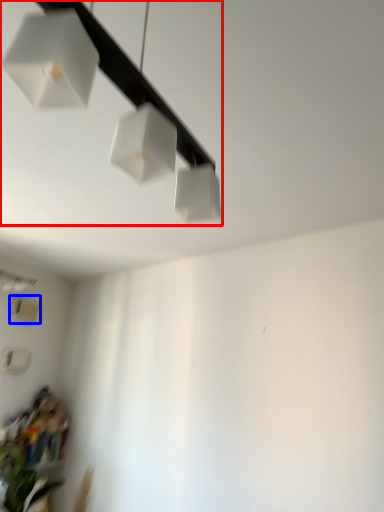
Question: Which object appears closest to the camera in this image, lamp (highlighted by a red box) or lamp (highlighted by a blue box)?

Choices:
 (A) lamp
 (B) lamp

Answer: (A)